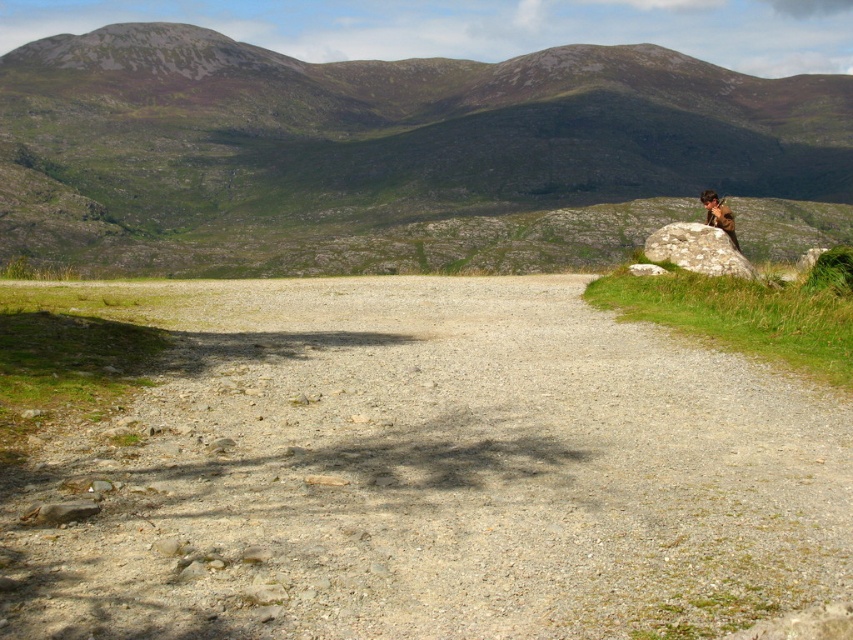
Question: Which object is positioned closest to the brown fuzzy jacket at upper right?

Choices:
 (A) green grassy mountain at upper center
 (B) gray gravel dirt track at center

Answer: (B)

Question: Which point appears closest to the camera in this image?

Choices:
 (A) (695, 241)
 (B) (712, 221)

Answer: (A)

Question: Can you confirm if green grassy mountain at upper center is positioned above brown fuzzy jacket at upper right?

Choices:
 (A) no
 (B) yes

Answer: (B)

Question: Among these objects, which one is farthest from the camera?

Choices:
 (A) brown fuzzy jacket at upper right
 (B) speckled gray rock at right

Answer: (A)

Question: Is gray gravel dirt track at center closer to camera compared to brown fuzzy jacket at upper right?

Choices:
 (A) yes
 (B) no

Answer: (A)

Question: Can you confirm if gray gravel dirt track at center is smaller than green grassy mountain at upper center?

Choices:
 (A) no
 (B) yes

Answer: (B)